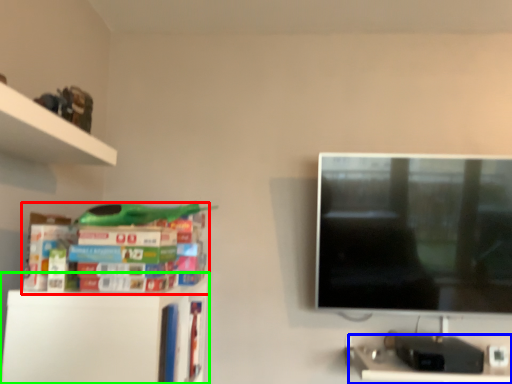
Question: Considering the real-world distances, which object is farthest from book (highlighted by a red box)? computer desk (highlighted by a blue box) or shelf (highlighted by a green box)?

Choices:
 (A) computer desk
 (B) shelf

Answer: (A)